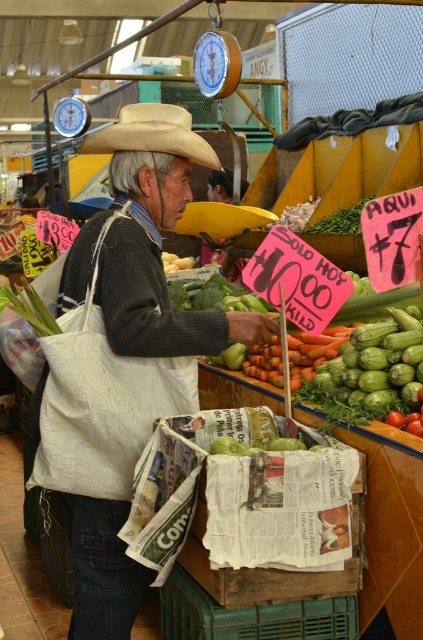
Question: Considering the real-world distances, which object is closest to the green matte zucchini at center?

Choices:
 (A) yellow matte potato at center
 (B) light brown felt cowboy hat at center

Answer: (B)

Question: Is light brown felt cowboy hat at center bigger than yellow matte potato at center?

Choices:
 (A) yes
 (B) no

Answer: (A)

Question: Is green matte zucchini at center smaller than yellow matte potato at center?

Choices:
 (A) no
 (B) yes

Answer: (A)

Question: Is the position of green matte zucchini at center more distant than that of yellow matte potato at center?

Choices:
 (A) yes
 (B) no

Answer: (B)

Question: Which of the following is the closest to the observer?

Choices:
 (A) green matte zucchini at center
 (B) yellow matte potato at center
 (C) light brown felt cowboy hat at center

Answer: (A)

Question: Which point is closer to the camera?

Choices:
 (A) green matte zucchini at center
 (B) light brown felt cowboy hat at center

Answer: (A)